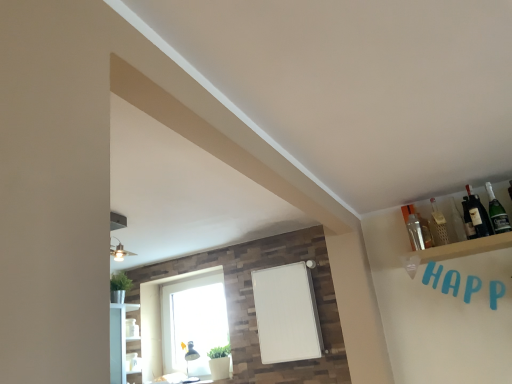
Question: Based on their sizes in the image, would you say white glass window at lower center is bigger or smaller than clear glass bottle at upper right, which appears as the 5th bottle when viewed from the right?

Choices:
 (A) big
 (B) small

Answer: (A)

Question: Considering the positions of white glass window at lower center and clear glass bottle at upper right, which appears as the 5th bottle when viewed from the right, in the image, is white glass window at lower center taller or shorter than clear glass bottle at upper right, which appears as the 5th bottle when viewed from the right,?

Choices:
 (A) short
 (B) tall

Answer: (B)

Question: Based on their relative distances, which object is farther from the white glass window at lower center?

Choices:
 (A) clear glass bottle at upper right, which appears as the 5th bottle when viewed from the right
 (B) dark glass bottle at upper right, the 4th bottle from the left
 (C) matte glass bottle at upper right, positioned as the 3th bottle in right-to-left order
 (D) clear glass bottle at upper right, arranged as the second bottle when viewed from the left
 (E) green glass bottle at upper right, which is the 5th bottle from left to right

Answer: (E)

Question: Based on their relative distances, which object is farther from the matte glass bottle at upper right, marked as the third bottle in a left-to-right arrangement?

Choices:
 (A) white glass window at lower center
 (B) clear glass bottle at upper right, the 4th bottle viewed from the right
 (C) clear glass bottle at upper right, which appears as the 5th bottle when viewed from the right
 (D) green glass bottle at upper right, which is the first bottle from right to left
 (E) dark glass bottle at upper right, the 4th bottle from the left

Answer: (A)